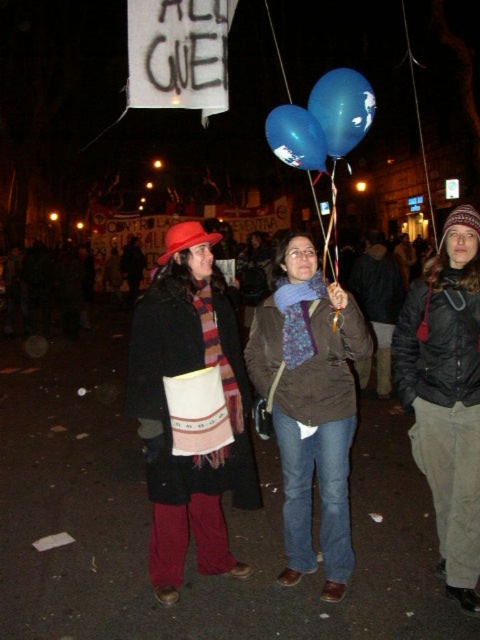
You are a photographer trying to capture a photo of the blue glossy balloon at center and the glossy blue balloon at center. The balloons are part of a protest event, and you need to ensure they are both in frame. Given that your camera has a minimum focus distance of 50 centimeters, will you be able to capture both balloons clearly in the same shot?

The blue glossy balloon at center and glossy blue balloon at center are 49.64 centimeters apart, which is less than the camera minimum focus distance of 50 centimeters. Therefore, you can capture both balloons clearly in the same shot.

You are a photographer trying to capture the knitted wool scarf at center and the matte brown jacket at center in a single shot. Based on their positions, which one is closer to the top edge of the photo?

The knitted wool scarf at center is located above the matte brown jacket at center, so it is closer to the top edge of the photo.

You are a photographer trying to capture the scene. You notice the knitted wool scarf at center and the matte brown jacket at center. Which object is wider when viewed from your camera angle?

The knitted wool scarf at center is wider than the matte brown jacket at center.